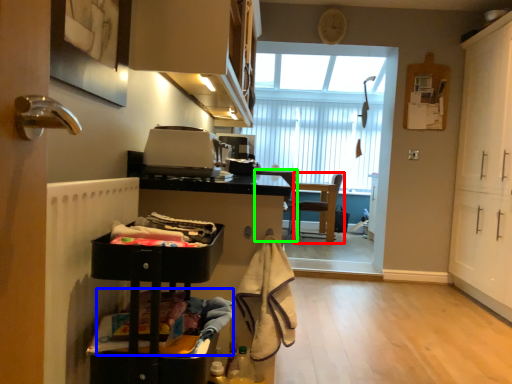
Question: Which is farther away from chair (highlighted by a red box)? laundry (highlighted by a blue box) or chair (highlighted by a green box)?

Choices:
 (A) laundry
 (B) chair

Answer: (A)